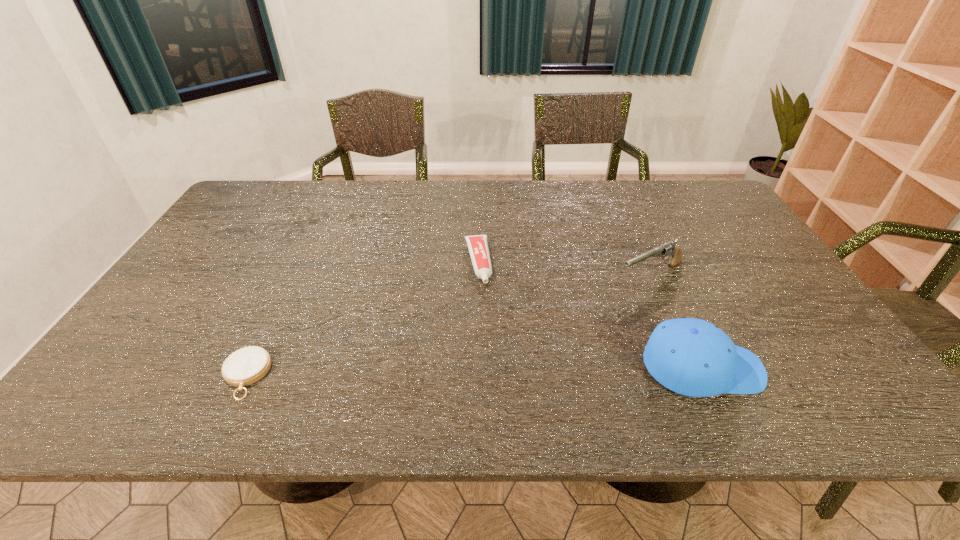
At what (x,y) coordinates should I click in order to perform the action: click on blank space located 0.330m aiming along the barrel of the gun. Please return your answer as a coordinate pair (x, y). The image size is (960, 540). Looking at the image, I should click on (523, 332).

Image resolution: width=960 pixels, height=540 pixels. What are the coordinates of `free space located at the nozzle of the second object from left to right` in the screenshot? It's located at (484, 308).

Identify the location of free space located at the nozzle of the second object from left to right. The height and width of the screenshot is (540, 960). (488, 328).

Find the location of a particular element. This screenshot has height=540, width=960. blank area located 0.070m at the nozzle of the second object from left to right is located at coordinates (483, 306).

The image size is (960, 540). Find the location of `compass that is at the near edge`. compass that is at the near edge is located at coordinates (245, 366).

Find the location of a particular element. cap present at the near edge is located at coordinates (693, 357).

The height and width of the screenshot is (540, 960). I want to click on free space at the far edge, so click(361, 201).

Identify the location of vacant space at the near edge. (519, 348).

Identify the location of blank space at the left edge of the desktop. (206, 242).

In the image, there is a desktop. Identify the location of vacant space at the right edge. This screenshot has width=960, height=540. (725, 260).